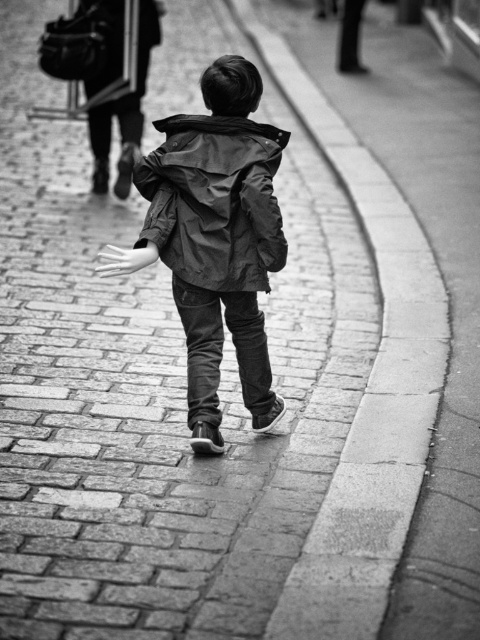
Can you confirm if dark green fabric jacket at center is positioned below matte black jacket at center?

Correct, dark green fabric jacket at center is located below matte black jacket at center.

Between dark green fabric jacket at center and matte black jacket at center, which one has less height?

With less height is matte black jacket at center.

Is point (216, 412) in front of point (160, 220)?

No, (216, 412) is further to viewer.

Where is `dark green fabric jacket at center`? dark green fabric jacket at center is located at coordinates (216, 241).

Does smooth concrete curb at center appear under dark green fabric jacket at center?

No.

Is smooth concrete curb at center shorter than dark green fabric jacket at center?

Incorrect, smooth concrete curb at center's height does not fall short of dark green fabric jacket at center's.

Is point (357, 493) positioned behind point (189, 129)?

That is False.

You are a GUI agent. You are given a task and a screenshot of the screen. Output one action in this format:
    pyautogui.click(x=<x>, y=<y>)
    Task: Click on the smooth concrete curb at center
    
    Given the screenshot: What is the action you would take?
    pyautogui.click(x=365, y=387)

Is point (365, 513) less distant than point (113, 42)?

Yes, it is in front of point (113, 42).

Identify the location of smooth concrete curb at center. (365, 387).

Does point (368, 500) come behind point (119, 186)?

No, it is not.

Find the location of a particular element. This screenshot has height=640, width=480. smooth concrete curb at center is located at coordinates (365, 387).